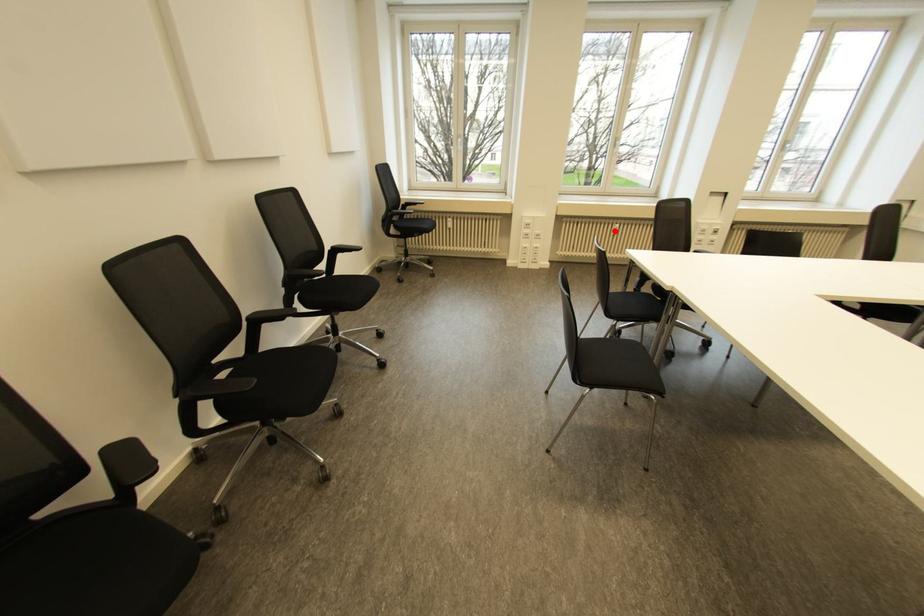
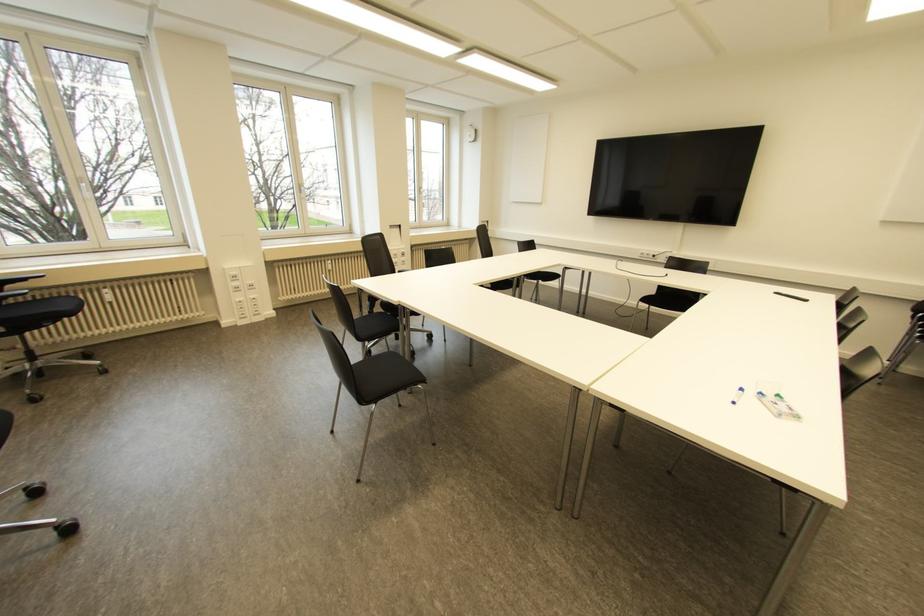
Find the pixel in the second image that matches the highlighted location in the first image.

(330, 267)